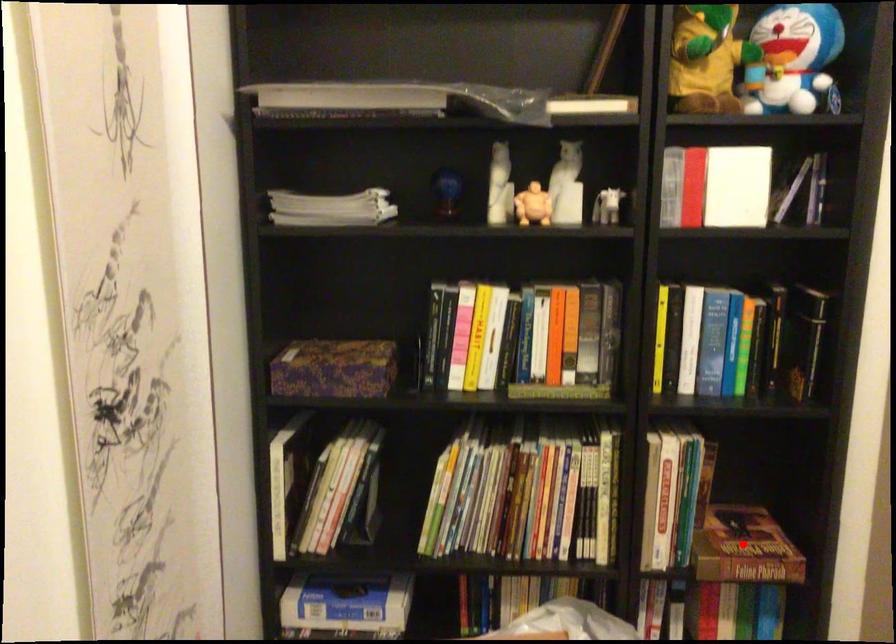
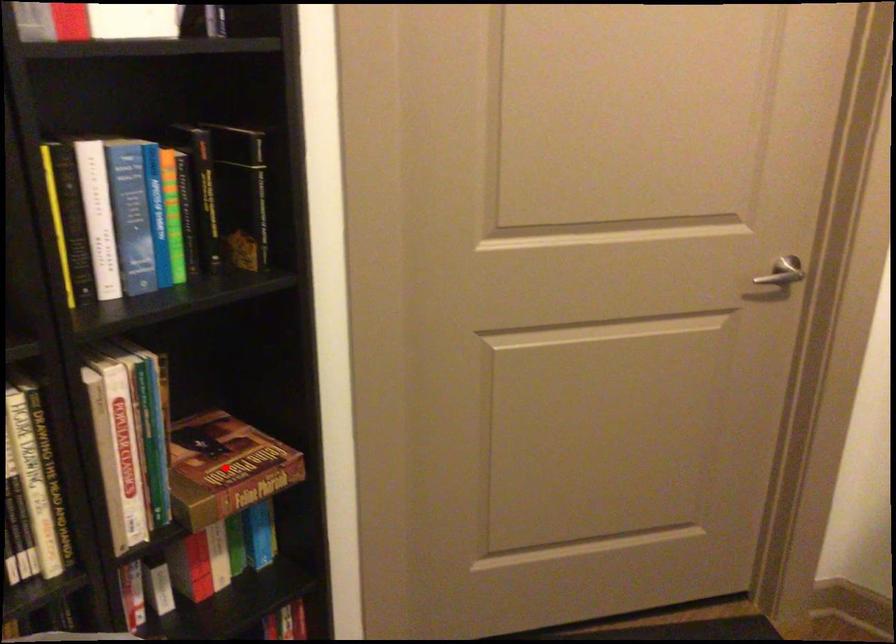
I am providing you with two images of the same scene from different viewpoints. A red point is marked on the first image and another point is marked on the second image. Does the point marked in image1 correspond to the same location as the one in image2?

Yes